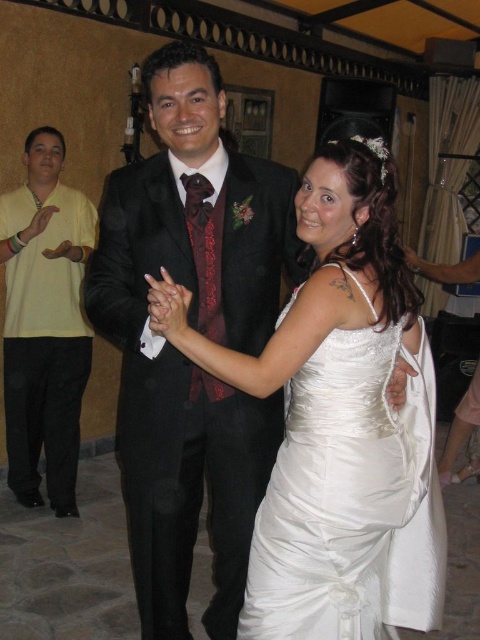
Can you confirm if shiny black suit at center is bigger than satin white dress at center?

Correct, shiny black suit at center is larger in size than satin white dress at center.

Describe the element at coordinates (194, 328) in the screenshot. This screenshot has height=640, width=480. I see `shiny black suit at center` at that location.

Where is `shiny black suit at center`? shiny black suit at center is located at coordinates (194, 328).

Is satin white dress at center positioned before yellow cotton shirt at left?

Yes, it is.

Is satin white dress at center below yellow cotton shirt at left?

Yes, satin white dress at center is below yellow cotton shirt at left.

Locate an element on the screen. The width and height of the screenshot is (480, 640). satin white dress at center is located at coordinates [x=335, y=419].

Where is `satin white dress at center`? Image resolution: width=480 pixels, height=640 pixels. satin white dress at center is located at coordinates (335, 419).

What do you see at coordinates (194, 328) in the screenshot? I see `shiny black suit at center` at bounding box center [194, 328].

Is point (131, 513) positioned in front of point (64, 220)?

Yes, point (131, 513) is in front of point (64, 220).

Which is in front, point (178, 461) or point (49, 328)?

Point (178, 461)

This screenshot has width=480, height=640. Identify the location of shiny black suit at center. (194, 328).